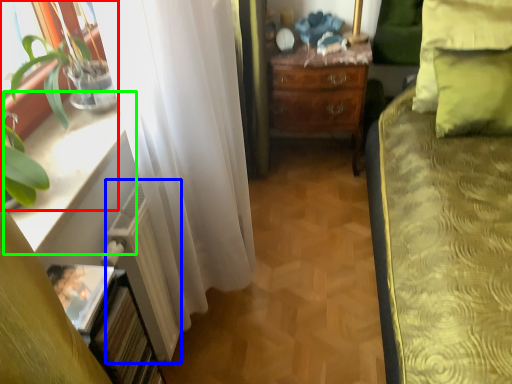
Question: Which object is the farthest from houseplant (highlighted by a red box)? Choose among these: radiator (highlighted by a blue box) or window sill (highlighted by a green box).

Choices:
 (A) radiator
 (B) window sill

Answer: (A)